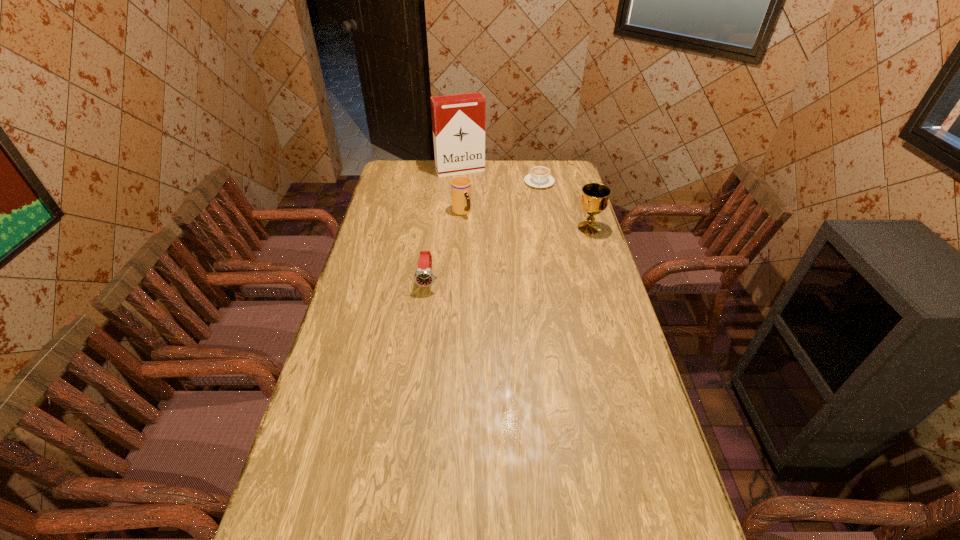
Where is `free space on the desktop that is between the fourth tallest object and the fourth shortest object and is positioned on the side of the cappuccino with the handle`? The width and height of the screenshot is (960, 540). free space on the desktop that is between the fourth tallest object and the fourth shortest object and is positioned on the side of the cappuccino with the handle is located at coordinates (531, 247).

Image resolution: width=960 pixels, height=540 pixels. Find the location of `free space on the desktop that is between the watch and the fourth shortest object and is positioned on the side of the third shortest object with the handle`. free space on the desktop that is between the watch and the fourth shortest object and is positioned on the side of the third shortest object with the handle is located at coordinates (501, 257).

This screenshot has width=960, height=540. What are the coordinates of `free space on the desktop that is between the watch and the second tallest object and is positioned on the front-facing side of the tallest object` in the screenshot? It's located at [x=502, y=256].